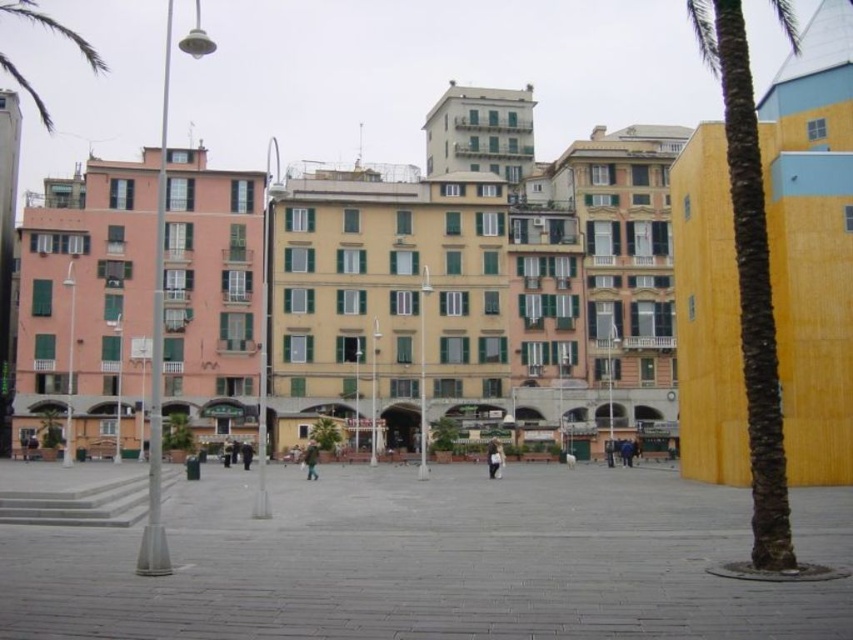
You are a photographer standing in the urban square and want to capture a photo of the yellow matte palm tree at right and the green fabric person at center. Since you want both subjects in the frame, which direction should you move to ensure both are visible?

You should move to the left side of the green fabric person at center so that both the yellow matte palm tree at right and the green fabric person at center are in your frame since the palm tree is on the right side of the person.

You are a photographer standing at the edge of the square. You want to take a photo of the yellow matte palm tree at right and the light brown leather jacket at center. Which object will appear larger in the photo?

The yellow matte palm tree at right is taller than the light brown leather jacket at center, so it will appear larger in the photo.